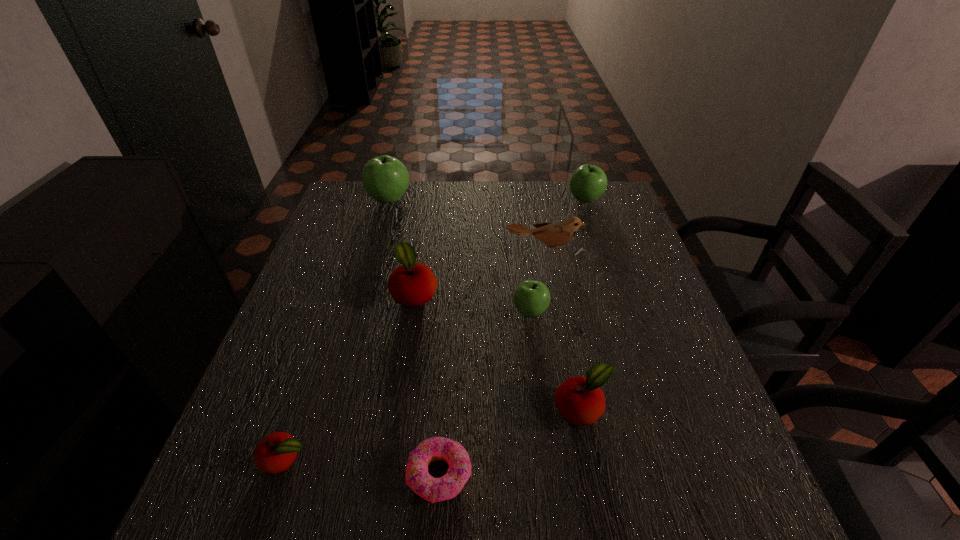
Find the location of a particular element. The image size is (960, 540). free space between the tallest object and the nearest green apple is located at coordinates (460, 255).

Find the location of a particular element. blank region between the leftmost green apple and the rightmost apple is located at coordinates (487, 199).

Find the location of a particular element. vacant area that lies between the shortest apple and the biggest green apple is located at coordinates (337, 329).

This screenshot has width=960, height=540. In order to click on blank region between the third nearest object and the farthest red apple in this screenshot , I will do click(498, 350).

You are a GUI agent. You are given a task and a screenshot of the screen. Output one action in this format:
    pyautogui.click(x=<x>, y=<y>)
    Task: Click on the free spot between the pink doughnut and the nearest green apple
    
    Given the screenshot: What is the action you would take?
    pyautogui.click(x=485, y=393)

I want to click on object that stands as the third closest to the doughnut, so click(x=531, y=298).

The image size is (960, 540). Find the location of `object identified as the sixth closest to the sixth farthest object`. object identified as the sixth closest to the sixth farthest object is located at coordinates (588, 183).

Locate an element on the screen. The image size is (960, 540). apple that stands as the closest to the bird is located at coordinates (531, 298).

Identify which apple is located as the fifth nearest to the biggest green apple. Please provide its 2D coordinates. Your answer should be formatted as a tuple, i.e. [(x, y)], where the tuple contains the x and y coordinates of a point satisfying the conditions above.

[(275, 453)]

Find the location of a particular element. green apple that stands as the closest to the tallest apple is located at coordinates (531, 298).